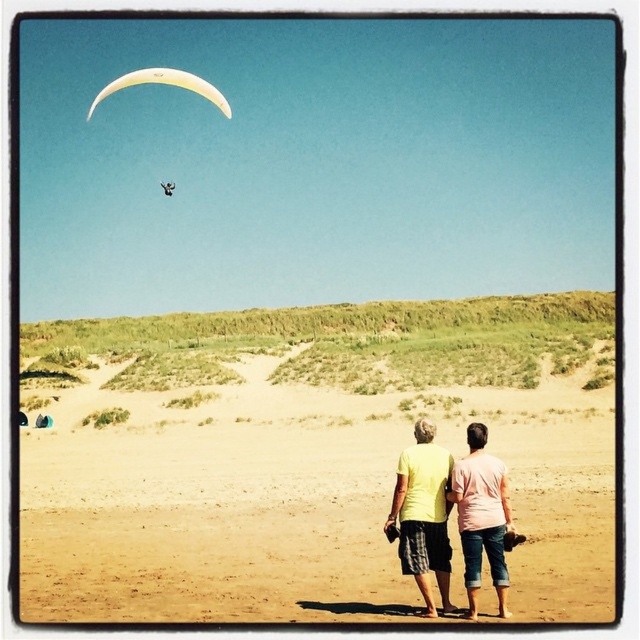
Question: Estimate the real-world distances between objects in this image. Which object is closer to the yellow matte shirt at center?

Choices:
 (A) yellow fabric parachute at upper center
 (B) sandy yellow beach at center
 (C) pink cotton shirt at lower right

Answer: (C)

Question: Does pink cotton shirt at lower right appear under yellow fabric parachute at upper center?

Choices:
 (A) no
 (B) yes

Answer: (B)

Question: Among these objects, which one is farthest from the camera?

Choices:
 (A) yellow matte shirt at center
 (B) yellow fabric parachute at upper center
 (C) pink cotton shirt at lower right
 (D) sandy yellow beach at center

Answer: (B)

Question: Which of the following is the closest to the observer?

Choices:
 (A) pink cotton shirt at lower right
 (B) sandy yellow beach at center
 (C) yellow fabric parachute at upper center

Answer: (B)

Question: Can you confirm if sandy yellow beach at center is positioned below yellow matte shirt at center?

Choices:
 (A) no
 (B) yes

Answer: (A)

Question: Does sandy yellow beach at center appear on the right side of pink cotton shirt at lower right?

Choices:
 (A) no
 (B) yes

Answer: (A)